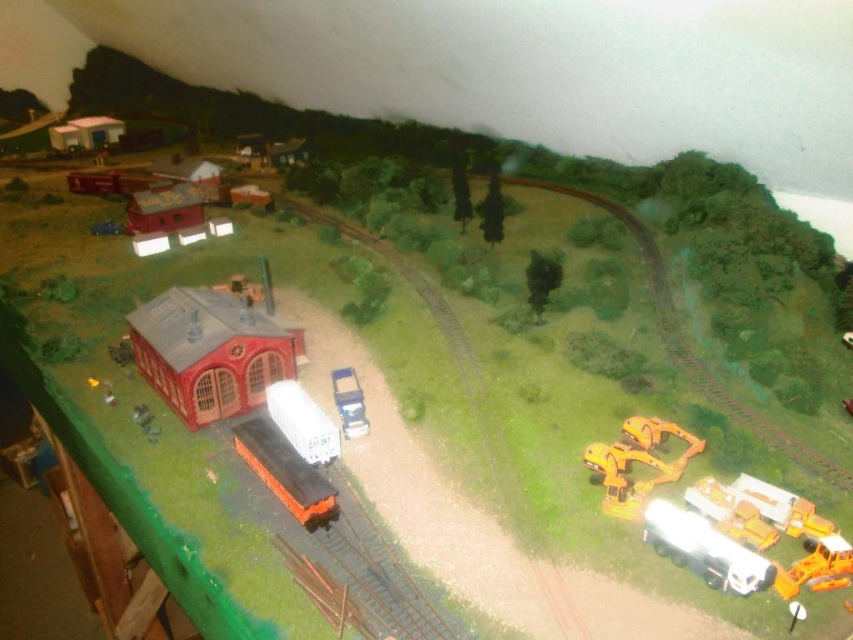
Who is more distant from viewer, [606,513] or [360,396]?

Positioned behind is point [360,396].

Which of these two, yellow plastic excavator at lower right or metallic blue truck at center, stands taller?

Standing taller between the two is yellow plastic excavator at lower right.

Which is in front, point (584, 458) or point (351, 420)?

Positioned in front is point (584, 458).

Image resolution: width=853 pixels, height=640 pixels. I want to click on yellow plastic excavator at lower right, so click(x=637, y=461).

Can you confirm if orange matte train car at center is positioned to the right of metallic blue truck at center?

No, orange matte train car at center is not to the right of metallic blue truck at center.

From the picture: Does orange matte train car at center have a lesser height compared to metallic blue truck at center?

No.

Is point (241, 420) positioned after point (357, 404)?

No, it is in front of (357, 404).

What are the coordinates of `orange matte train car at center` in the screenshot? It's located at (283, 470).

Between point (781, 572) and point (338, 410), which one is positioned in front?

Point (781, 572)

Does point (798, 586) come farther from viewer compared to point (341, 394)?

No, (798, 586) is in front of (341, 394).

Image resolution: width=853 pixels, height=640 pixels. In order to click on metallic yellow excavator at lower right in this screenshot , I will do `click(816, 568)`.